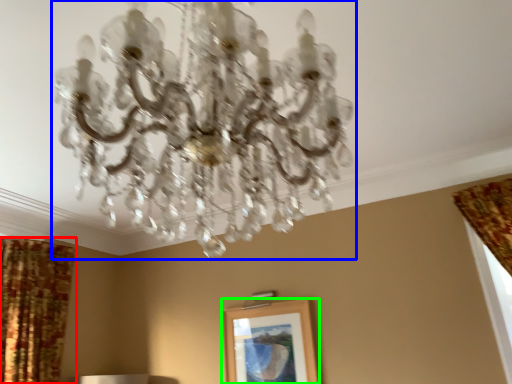
Question: Which object is the farthest from curtain (highlighted by a red box)? Choose among these: lamp (highlighted by a blue box) or picture frame (highlighted by a green box).

Choices:
 (A) lamp
 (B) picture frame

Answer: (A)